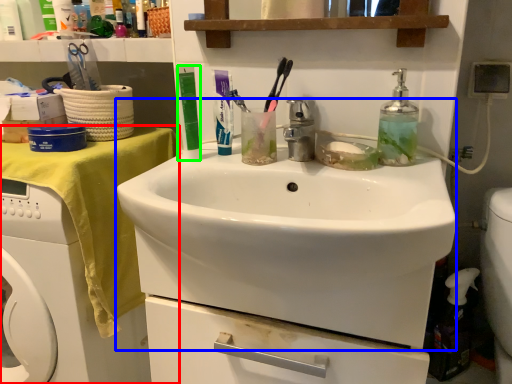
Question: Based on their relative distances, which object is nearer to desk (highlighted by a red box)? Choose from sink (highlighted by a blue box) and toiletry (highlighted by a green box).

Choices:
 (A) sink
 (B) toiletry

Answer: (B)